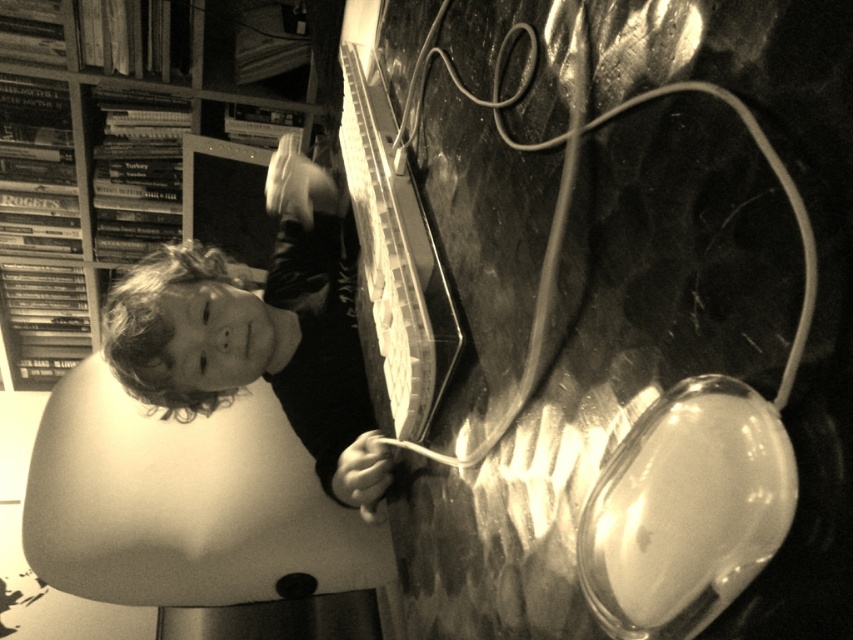
You are a visitor entering a room and notice a smooth skin child at upper left and a wooden bookshelf at upper left. Which object is closer to you when you first enter the room?

The smooth skin child at upper left is closer to you than the wooden bookshelf at upper left since the child is positioned in front of the bookshelf.

You are a photographer trying to capture a closeup of the smooth skin child at upper left and the wooden bookshelf at upper left. Given their sizes, which one would require you to move closer to get a detailed shot?

The smooth skin child at upper left is smaller than the wooden bookshelf at upper left, so to capture a detailed closeup, you would need to move closer to the smooth skin child at upper left.

You are a photographer analyzing this image. You notice a point at coordinates (260, 333). What is located at this point?

The point at coordinates (260, 333) is occupied by the smooth skin child at upper left.